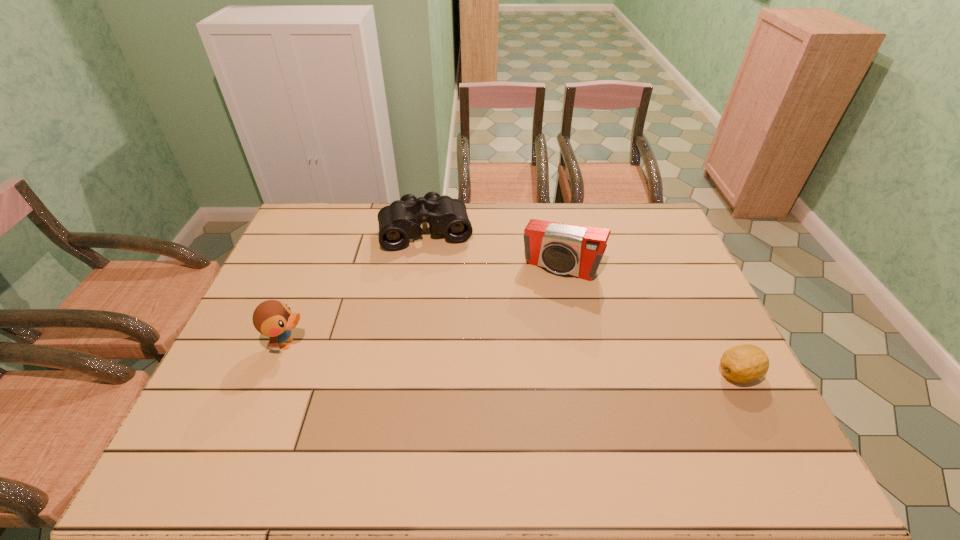
Where is `vacant space positioned 0.110m at the stem end of the nearest object`? vacant space positioned 0.110m at the stem end of the nearest object is located at coordinates (671, 374).

This screenshot has height=540, width=960. Find the location of `free space located on the front-facing side of the camera`. free space located on the front-facing side of the camera is located at coordinates (534, 309).

Find the location of a particular element. vacant space located 0.060m on the front-facing side of the camera is located at coordinates tap(541, 294).

Locate an element on the screen. This screenshot has height=540, width=960. free location located 0.050m on the front-facing side of the camera is located at coordinates (542, 292).

I want to click on free spot located 0.120m at the eyepieces of the binoculars, so click(x=437, y=276).

Locate an element on the screen. Image resolution: width=960 pixels, height=540 pixels. free space located 0.200m at the eyepieces of the binoculars is located at coordinates (440, 294).

This screenshot has height=540, width=960. I want to click on blank space located 0.100m at the eyepieces of the binoculars, so click(436, 272).

At what (x,y) coordinates should I click in order to perform the action: click on object that is at the far edge. Please return your answer as a coordinate pair (x, y). Looking at the image, I should click on (401, 220).

The width and height of the screenshot is (960, 540). I want to click on object at the left edge, so click(272, 318).

Locate an element on the screen. Image resolution: width=960 pixels, height=540 pixels. object located at the right edge is located at coordinates (745, 363).